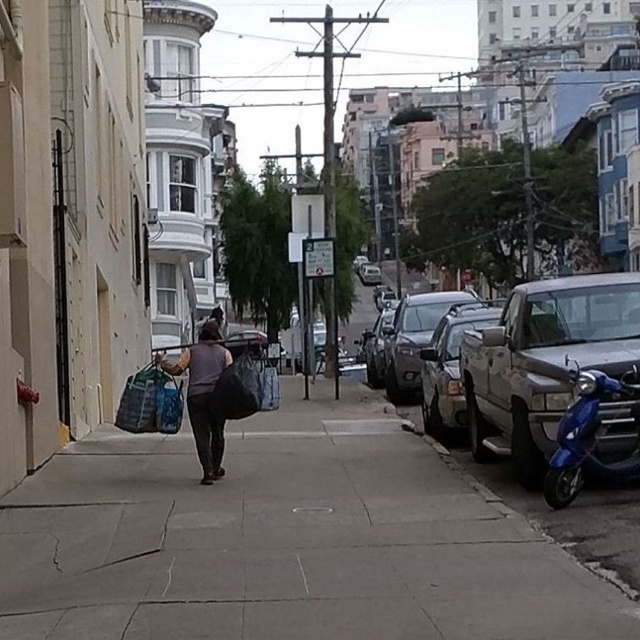
Between dark brown fabric bag at center and textured fabric bag at center-left, which one has more height?

dark brown fabric bag at center is taller.

Which is in front, point (196, 442) or point (129, 388)?

Point (196, 442) is in front.

The width and height of the screenshot is (640, 640). I want to click on dark brown fabric bag at center, so click(x=204, y=396).

What do you see at coordinates (285, 541) in the screenshot? The width and height of the screenshot is (640, 640). I see `gray concrete sidewalk at center` at bounding box center [285, 541].

Can you confirm if gray concrete sidewalk at center is bigger than dark brown fabric bag at center?

Yes.

Is point (531, 563) positioned after point (212, 372)?

No.

You are a GUI agent. You are given a task and a screenshot of the screen. Output one action in this format:
    pyautogui.click(x=<x>, y=<y>)
    Task: Click on the gray concrete sidewalk at center
    The height and width of the screenshot is (640, 640).
    Given the screenshot: What is the action you would take?
    pyautogui.click(x=285, y=541)

Does silver metallic truck at center appear on the right side of dark brown fabric bag at center?

Correct, you'll find silver metallic truck at center to the right of dark brown fabric bag at center.

How far apart are silver metallic truck at center and dark brown fabric bag at center?

4.43 meters

Who is more forward, (454, 371) or (188, 394)?

Positioned in front is point (188, 394).

Locate an element on the screen. This screenshot has height=640, width=640. silver metallic truck at center is located at coordinates (449, 368).